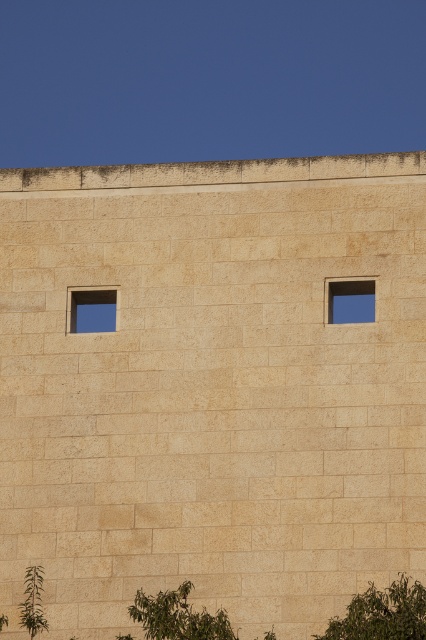
Is green leafy tree at lower center bigger than transparent glass window at upper left?

Incorrect, green leafy tree at lower center is not larger than transparent glass window at upper left.

Who is shorter, green leafy tree at lower center or transparent glass window at upper left?

transparent glass window at upper left is shorter.

The width and height of the screenshot is (426, 640). I want to click on green leafy tree at lower center, so click(178, 616).

Where is `green leafy tree at lower center`? green leafy tree at lower center is located at coordinates (178, 616).

Is transparent glass window at upper left to the left of green leafy plant at lower left from the viewer's perspective?

In fact, transparent glass window at upper left is to the right of green leafy plant at lower left.

Who is taller, transparent glass window at upper left or green leafy plant at lower left?

Standing taller between the two is green leafy plant at lower left.

Where is `transparent glass window at upper left`? This screenshot has height=640, width=426. transparent glass window at upper left is located at coordinates (92, 308).

I want to click on transparent glass window at upper left, so click(x=92, y=308).

Who is positioned more to the left, transparent glass window at upper left or beige stone window at upper right?

transparent glass window at upper left is more to the left.

Is transparent glass window at upper left wider than beige stone window at upper right?

Yes.

Is point (114, 326) positioned before point (365, 291)?

No, (114, 326) is further to viewer.

Locate an element on the screen. The height and width of the screenshot is (640, 426). transparent glass window at upper left is located at coordinates (92, 308).